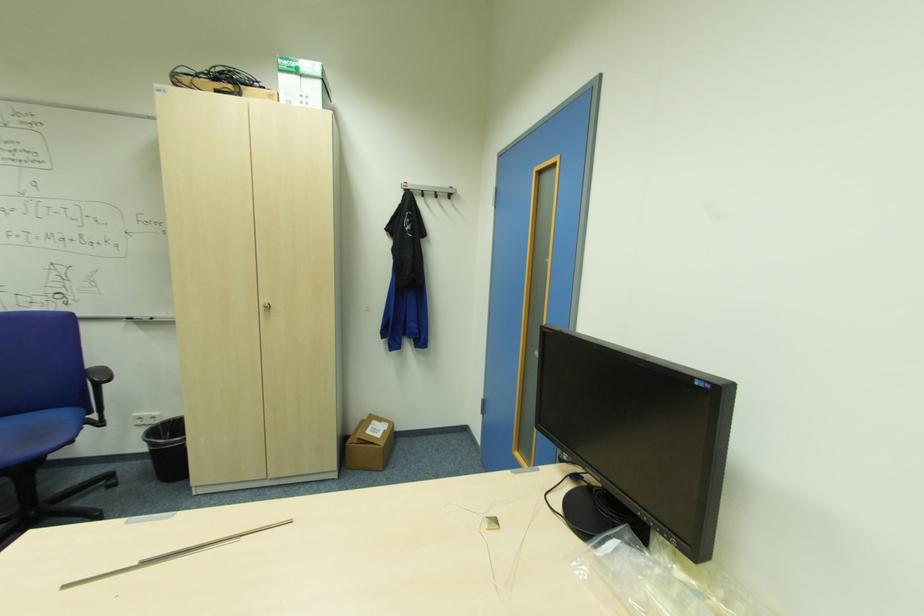
I want to click on wall hook, so click(430, 188).